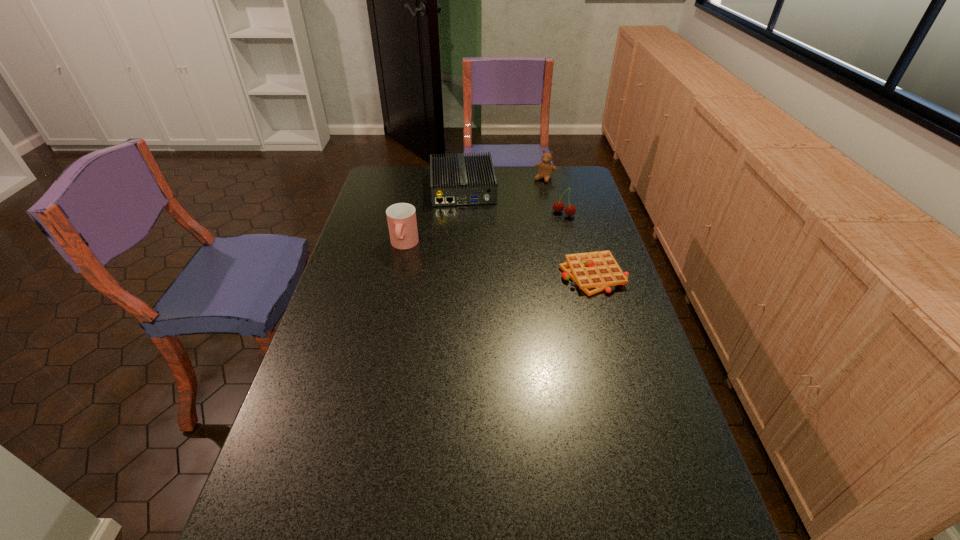
Locate an element on the screen. This screenshot has height=540, width=960. the leftmost object is located at coordinates (401, 217).

The width and height of the screenshot is (960, 540). What are the coordinates of `waffle` in the screenshot? It's located at (593, 272).

You are a GUI agent. You are given a task and a screenshot of the screen. Output one action in this format:
    pyautogui.click(x=<x>, y=<y>)
    Task: Click on the teddy bear
    
    Given the screenshot: What is the action you would take?
    pyautogui.click(x=546, y=168)

Find the location of `the fourth object from right to left`. the fourth object from right to left is located at coordinates (461, 180).

Image resolution: width=960 pixels, height=540 pixels. Identify the location of router. (461, 180).

This screenshot has width=960, height=540. Find the location of `cherry`. cherry is located at coordinates (570, 210).

At what (x,y) coordinates should I click in order to perform the action: click on free space located on the side of the cup with the handle. Please return your answer as a coordinate pair (x, y). The image size is (960, 540). Looking at the image, I should click on (391, 307).

Find the location of a particular element. Image resolution: width=960 pixels, height=540 pixels. vacant area located 0.160m on the front of the waffle is located at coordinates (612, 336).

You are a GUI agent. You are given a task and a screenshot of the screen. Output one action in this format:
    pyautogui.click(x=<x>, y=<y>)
    Task: Click on the vacant space located on the face of the teddy bear
    This screenshot has width=960, height=540.
    Given the screenshot: What is the action you would take?
    pyautogui.click(x=507, y=226)

The image size is (960, 540). I want to click on free spot located 0.070m on the face of the teddy bear, so click(x=535, y=191).